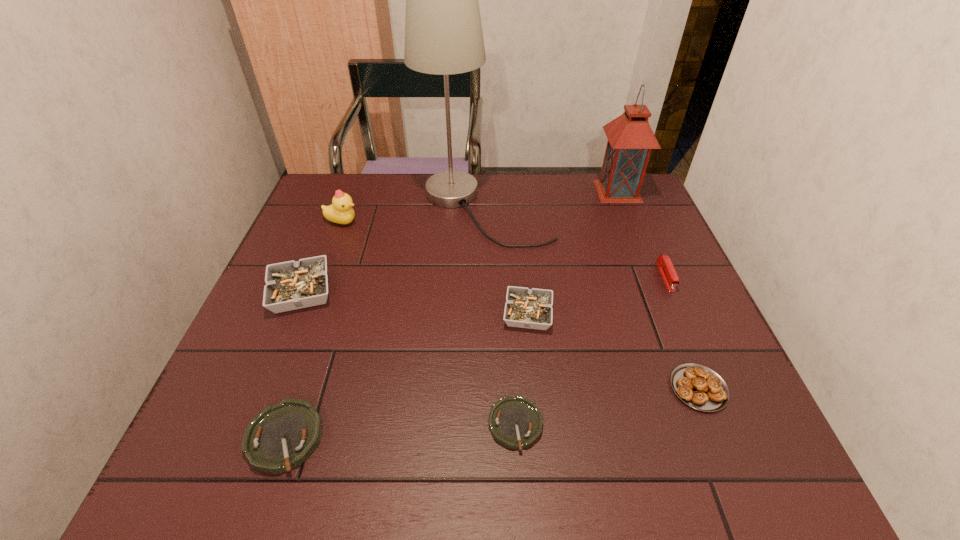
Find the location of `stapler that is at the right edge`. stapler that is at the right edge is located at coordinates (665, 266).

Where is `pastry positioned at the right edge`? The image size is (960, 540). pastry positioned at the right edge is located at coordinates (701, 388).

Find the location of a particular element. The height and width of the screenshot is (540, 960). object at the far left corner is located at coordinates [x=340, y=211].

Locate an element on the screen. The width and height of the screenshot is (960, 540). object at the near left corner is located at coordinates (283, 436).

Locate an element on the screen. object that is at the far right corner is located at coordinates (630, 141).

Locate an element on the screen. Image resolution: width=960 pixels, height=540 pixels. blank space at the far edge of the desktop is located at coordinates (517, 175).

Where is `vacant region at the near edge of the desktop`? Image resolution: width=960 pixels, height=540 pixels. vacant region at the near edge of the desktop is located at coordinates (684, 478).

The width and height of the screenshot is (960, 540). I want to click on vacant area at the left edge, so click(x=224, y=385).

Where is `vacant area at the right edge`? Image resolution: width=960 pixels, height=540 pixels. vacant area at the right edge is located at coordinates (686, 272).

Identify the location of vacant space at the near right corner. (773, 456).